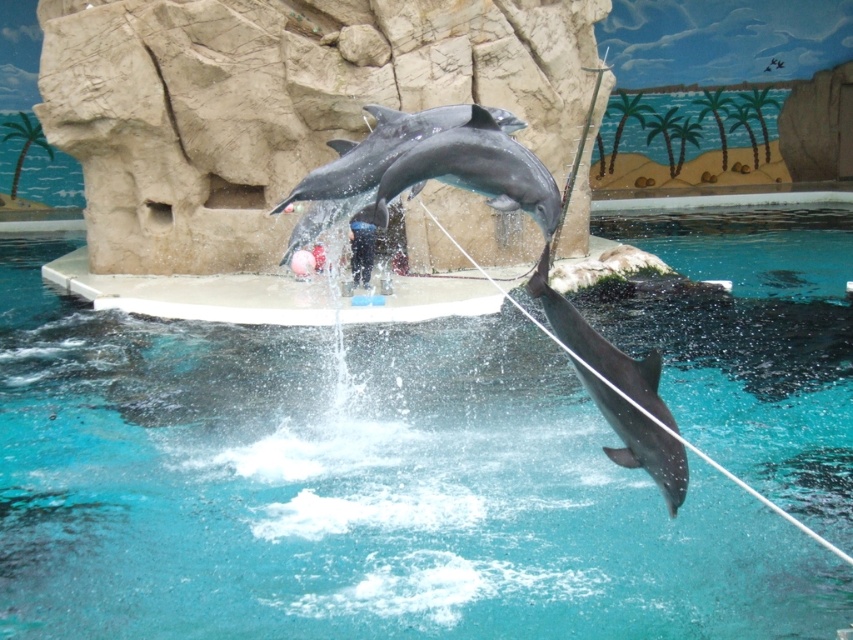
Question: Estimate the real-world distances between objects in this image. Which object is farther from the gray smooth dolphin at center?

Choices:
 (A) clear blue water at center
 (B) shiny gray dolphin at lower right
 (C) black rubber trainer at center

Answer: (A)

Question: Is shiny gray dolphin at lower right wider than gray smooth dolphin at center?

Choices:
 (A) yes
 (B) no

Answer: (B)

Question: Is clear blue water at center below shiny gray dolphin at lower right?

Choices:
 (A) no
 (B) yes

Answer: (B)

Question: Considering the real-world distances, which object is farthest from the gray smooth dolphin at center?

Choices:
 (A) clear blue water at center
 (B) black rubber trainer at center

Answer: (A)

Question: Which point is farther from the camera taking this photo?

Choices:
 (A) (506, 193)
 (B) (590, 394)

Answer: (A)

Question: Does clear blue water at center come behind shiny gray dolphin at lower right?

Choices:
 (A) yes
 (B) no

Answer: (B)